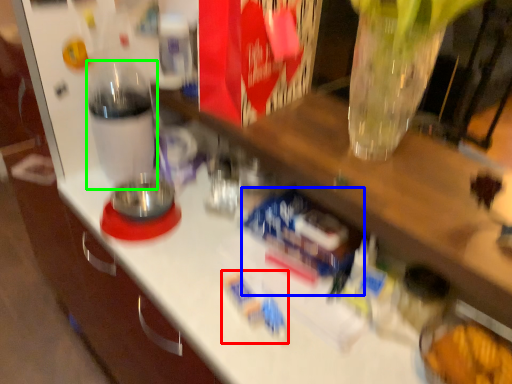
Question: Which is nearer to the toy (highlighted by a red box)? toy (highlighted by a blue box) or bottle (highlighted by a green box).

Choices:
 (A) toy
 (B) bottle

Answer: (A)